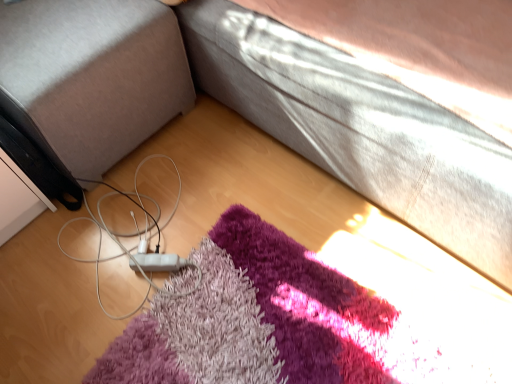
Question: Considering the relative sizes of white matte cable at lower left and matte black speaker at lower left in the image provided, is white matte cable at lower left shorter than matte black speaker at lower left?

Choices:
 (A) no
 (B) yes

Answer: (B)

Question: Can you confirm if white matte cable at lower left is taller than matte black speaker at lower left?

Choices:
 (A) yes
 (B) no

Answer: (B)

Question: Is white matte cable at lower left wider than matte black speaker at lower left?

Choices:
 (A) no
 (B) yes

Answer: (A)

Question: Could you tell me if white matte cable at lower left is facing matte black speaker at lower left?

Choices:
 (A) no
 (B) yes

Answer: (A)

Question: From a real-world perspective, is white matte cable at lower left located higher than matte black speaker at lower left?

Choices:
 (A) no
 (B) yes

Answer: (A)

Question: Is white matte cable at lower left with matte black speaker at lower left?

Choices:
 (A) no
 (B) yes

Answer: (A)

Question: Does matte black speaker at lower left have a greater width compared to white matte cable at lower left?

Choices:
 (A) no
 (B) yes

Answer: (B)

Question: Is matte black speaker at lower left next to white matte cable at lower left?

Choices:
 (A) yes
 (B) no

Answer: (B)

Question: Considering the relative sizes of matte black speaker at lower left and white matte cable at lower left in the image provided, is matte black speaker at lower left thinner than white matte cable at lower left?

Choices:
 (A) no
 (B) yes

Answer: (A)

Question: Are matte black speaker at lower left and white matte cable at lower left located far from each other?

Choices:
 (A) yes
 (B) no

Answer: (B)

Question: Is the depth of matte black speaker at lower left greater than that of white matte cable at lower left?

Choices:
 (A) no
 (B) yes

Answer: (A)

Question: From the image's perspective, is matte black speaker at lower left located beneath white matte cable at lower left?

Choices:
 (A) no
 (B) yes

Answer: (A)

Question: Is matte black speaker at lower left situated inside white matte cable at lower left or outside?

Choices:
 (A) outside
 (B) inside

Answer: (A)